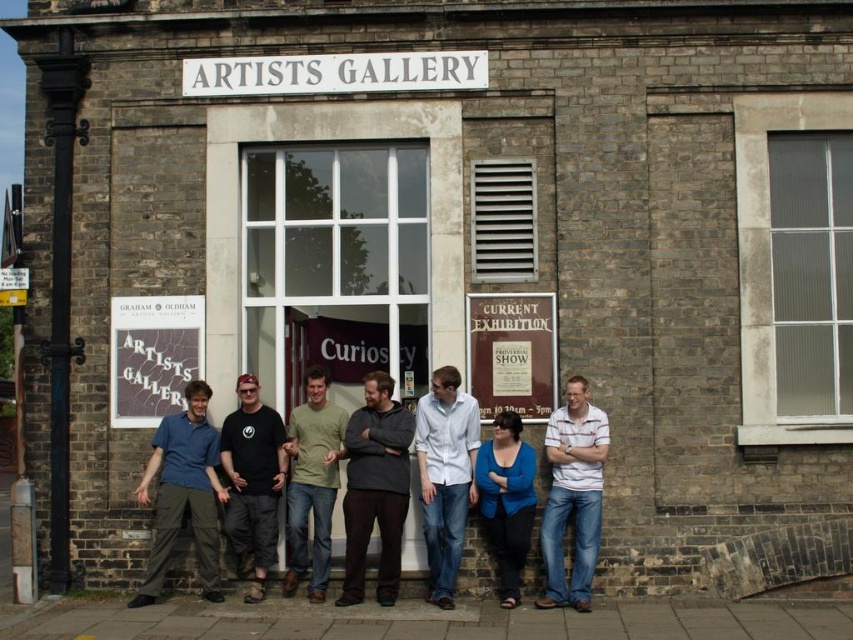
Question: Which point appears closest to the camera in this image?

Choices:
 (A) (270, 563)
 (B) (569, 600)
 (C) (405, 451)

Answer: (B)

Question: Is green cotton t-shirt at center to the left of blue matte shirt at center from the viewer's perspective?

Choices:
 (A) yes
 (B) no

Answer: (A)

Question: Which point appears farthest from the camera in this image?

Choices:
 (A) (587, 408)
 (B) (305, 456)
 (C) (447, 500)
 (D) (262, 557)

Answer: (B)

Question: Based on their relative distances, which object is farther from the black cotton t-shirt at center?

Choices:
 (A) matte blue shirt at center
 (B) dark gray sweater at center
 (C) white striped shirt at right
 (D) blue matte shirt at center

Answer: (C)

Question: Does white cotton shirt at center have a greater width compared to blue matte shirt at center?

Choices:
 (A) no
 (B) yes

Answer: (B)

Question: Does black cotton t-shirt at center have a larger size compared to blue matte shirt at center?

Choices:
 (A) yes
 (B) no

Answer: (A)